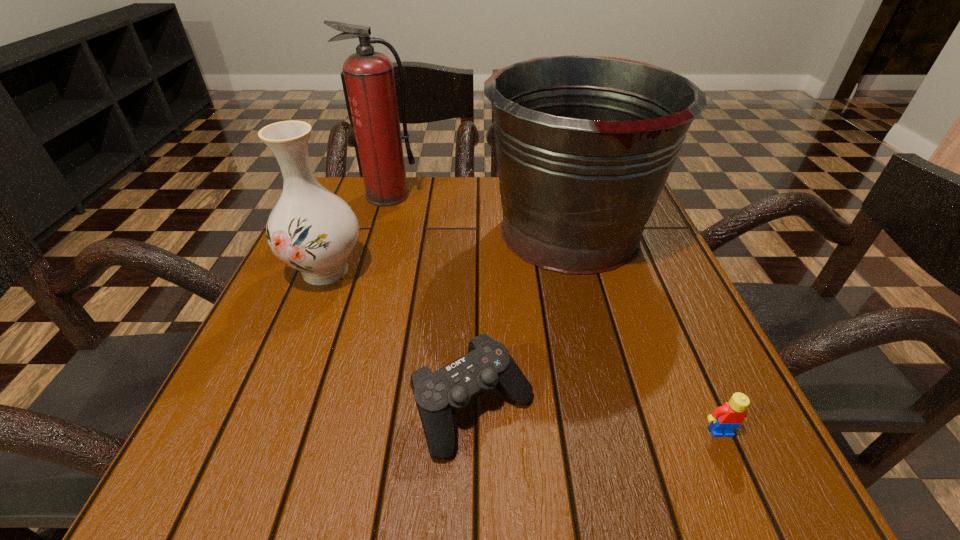
Where is `vacant area between the bucket and the tallest object`? vacant area between the bucket and the tallest object is located at coordinates (479, 213).

Where is `empty location between the control and the Lego`? empty location between the control and the Lego is located at coordinates tap(597, 420).

Identify the location of empty space that is in between the fire extinguisher and the bucket. (479, 213).

Identify which object is the second nearest to the control. Please provide its 2D coordinates. Your answer should be formatted as a tuple, i.e. [(x, y)], where the tuple contains the x and y coordinates of a point satisfying the conditions above.

[(310, 229)]

Locate which object ranks second in proximity to the vase. Please provide its 2D coordinates. Your answer should be formatted as a tuple, i.e. [(x, y)], where the tuple contains the x and y coordinates of a point satisfying the conditions above.

[(488, 365)]

You are a GUI agent. You are given a task and a screenshot of the screen. Output one action in this format:
    pyautogui.click(x=<x>, y=<y>)
    Task: Click on the vacant space that satisfies the following two spatial constraints: 1. at the nozzle of the tallest object; 2. on the left side of the bucket
    
    Given the screenshot: What is the action you would take?
    pyautogui.click(x=378, y=231)